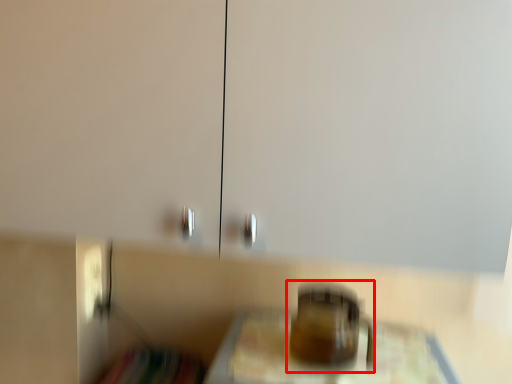
Question: Where is appliance (annotated by the red box) located in relation to furniture in the image?

Choices:
 (A) left
 (B) right

Answer: (A)